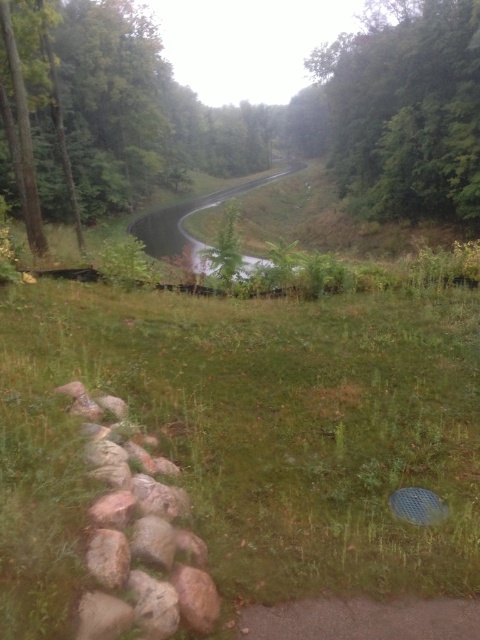
Which is more to the left, green grassy at center or green leafy tree at upper right?

green grassy at center is more to the left.

Is green grassy at center below green leafy tree at upper right?

Yes, green grassy at center is below green leafy tree at upper right.

The height and width of the screenshot is (640, 480). Describe the element at coordinates (247, 438) in the screenshot. I see `green grassy at center` at that location.

The image size is (480, 640). I want to click on green grassy at center, so click(247, 438).

Is green leafy tree at upper center to the right of green leafy tree at upper right from the viewer's perspective?

No, green leafy tree at upper center is not to the right of green leafy tree at upper right.

Where is `green leafy tree at upper center`? The height and width of the screenshot is (640, 480). green leafy tree at upper center is located at coordinates (111, 109).

In the scene shown: Measure the distance from green grassy at center to green leafy tree at upper center.

353.15 feet

Between point (379, 305) and point (57, 38), which one is positioned behind?

Positioned behind is point (57, 38).

Between point (204, 474) and point (92, 3), which one is positioned in front?

Point (204, 474) is more forward.

Locate an element on the screen. The width and height of the screenshot is (480, 640). green grassy at center is located at coordinates (247, 438).